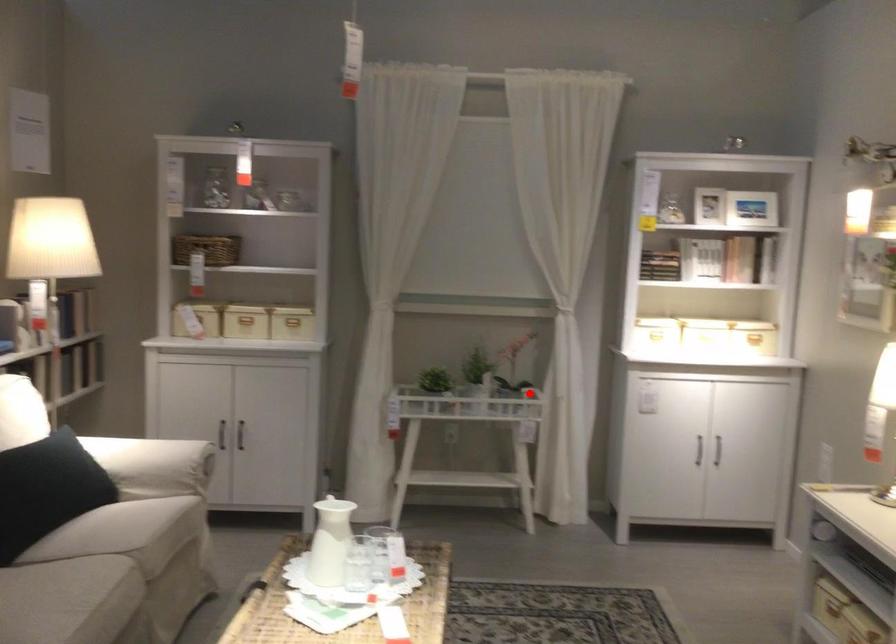
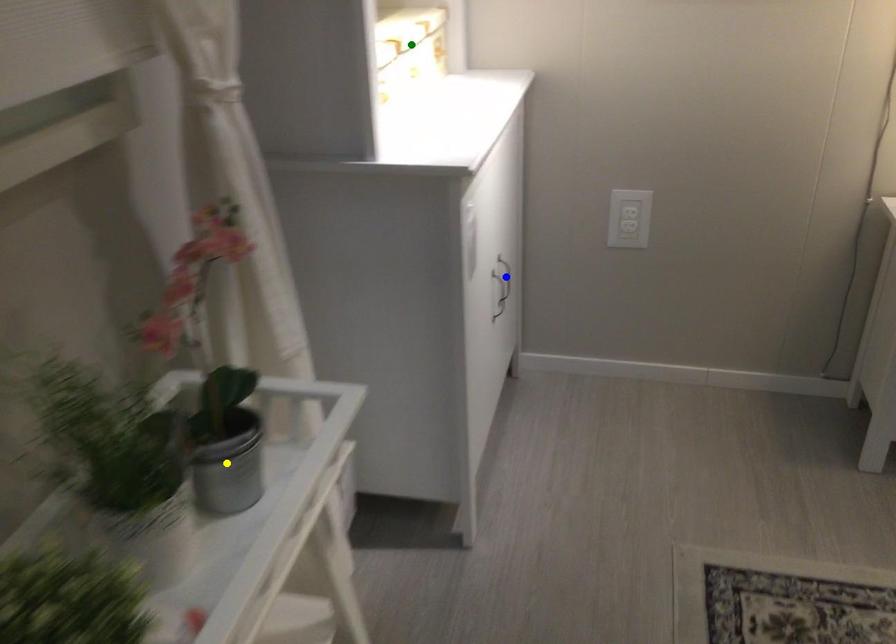
Question: I am providing you with two images of the same scene from different viewpoints. A red point is marked on the first image. You are given multiple points on the second image. Which point in image 2 is actually the same real-world point as the red point in image 1?

Choices:
 (A) blue point
 (B) green point
 (C) yellow point

Answer: (C)